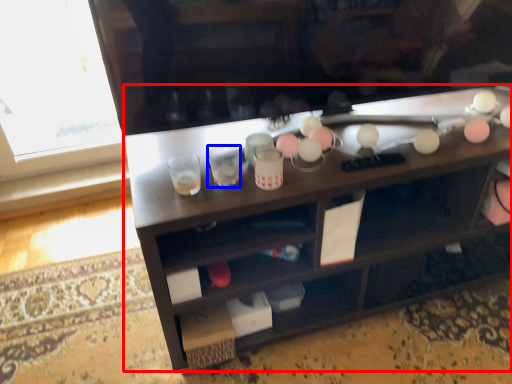
Question: Among these objects, which one is nearest to the camera, desk (highlighted by a red box) or shot glass (highlighted by a blue box)?

Choices:
 (A) desk
 (B) shot glass

Answer: (A)